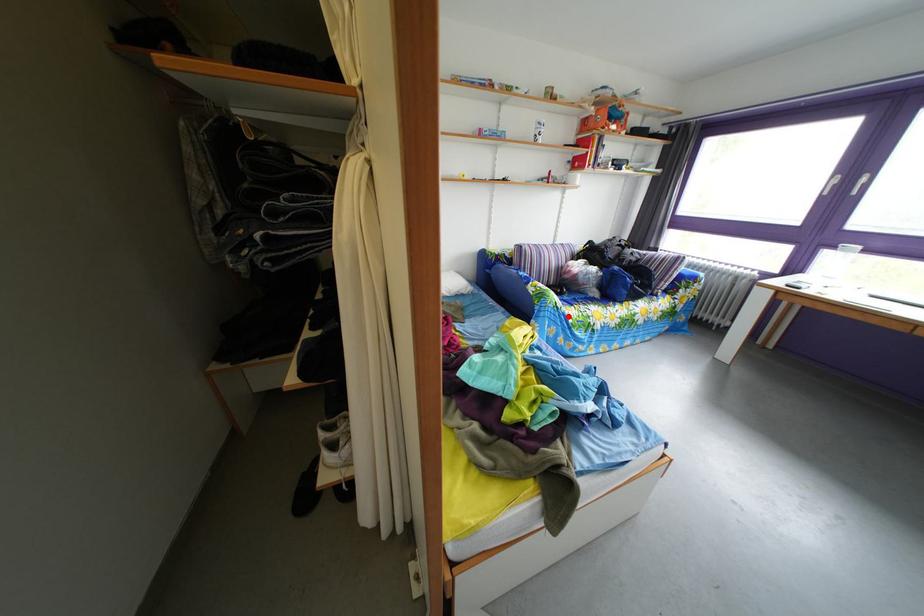
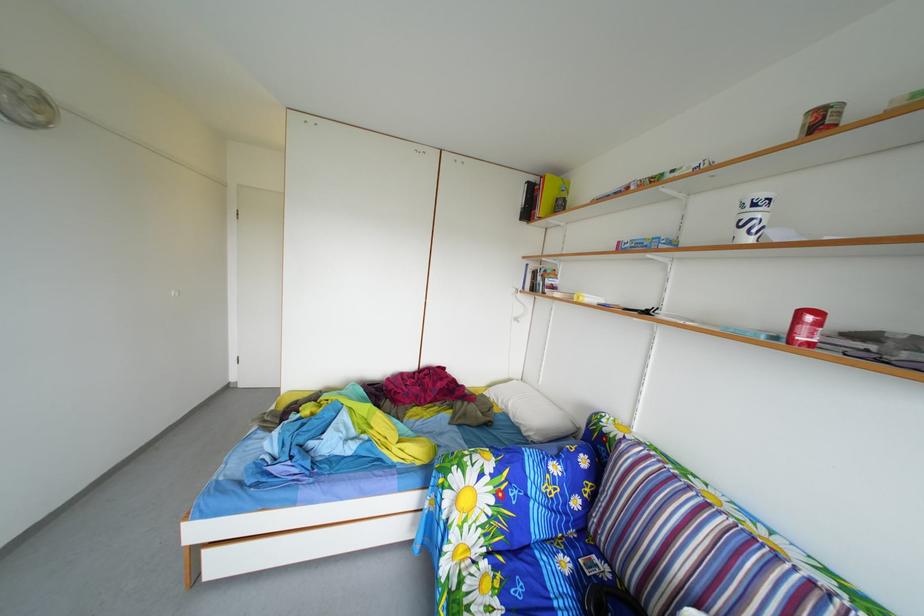
In the second image, find the point that corresponds to the highlighted location in the first image.

(453, 507)